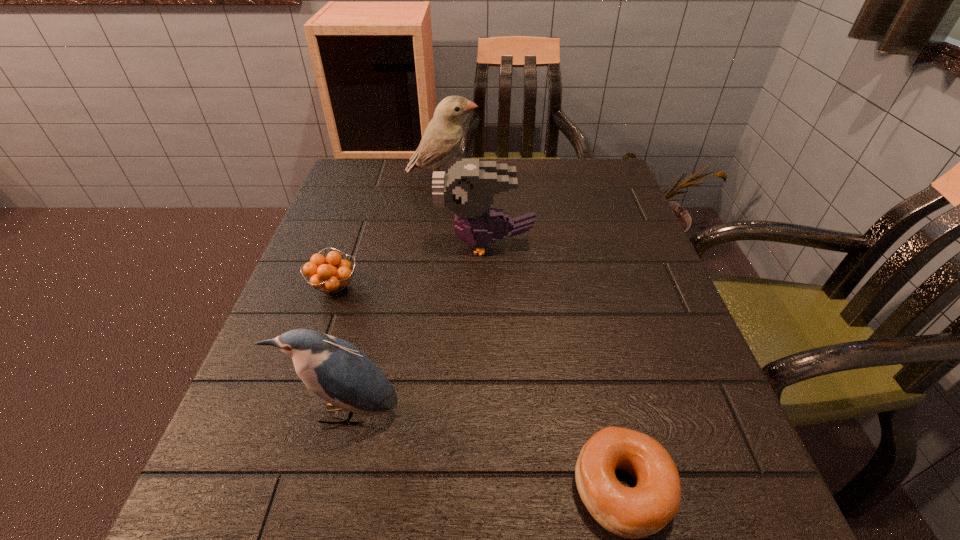
Where is `the farthest bird`? The height and width of the screenshot is (540, 960). the farthest bird is located at coordinates (443, 135).

In order to click on the second nearest bird in this screenshot , I will do `click(468, 189)`.

At what (x,y) coordinates should I click in order to perform the action: click on the nearest bird. Please return your answer as a coordinate pair (x, y). This screenshot has width=960, height=540. Looking at the image, I should click on (335, 370).

Locate an element on the screen. The image size is (960, 540). orange fruit is located at coordinates (331, 274).

Find the location of a particular element. The height and width of the screenshot is (540, 960). the third nearest object is located at coordinates (331, 274).

Where is `vacant space located 0.130m at the face of the farthest object`? The height and width of the screenshot is (540, 960). vacant space located 0.130m at the face of the farthest object is located at coordinates (526, 180).

Where is `free location located 0.220m at the beak of the second farthest object`? free location located 0.220m at the beak of the second farthest object is located at coordinates (341, 245).

Where is `vacant space located at the beak of the second farthest object`? This screenshot has width=960, height=540. vacant space located at the beak of the second farthest object is located at coordinates (403, 245).

Locate an element on the screen. free space located 0.250m at the beak of the second farthest object is located at coordinates (327, 245).

Identify the location of vacant space located at the tip of the fourth farthest object's beak. (332, 467).